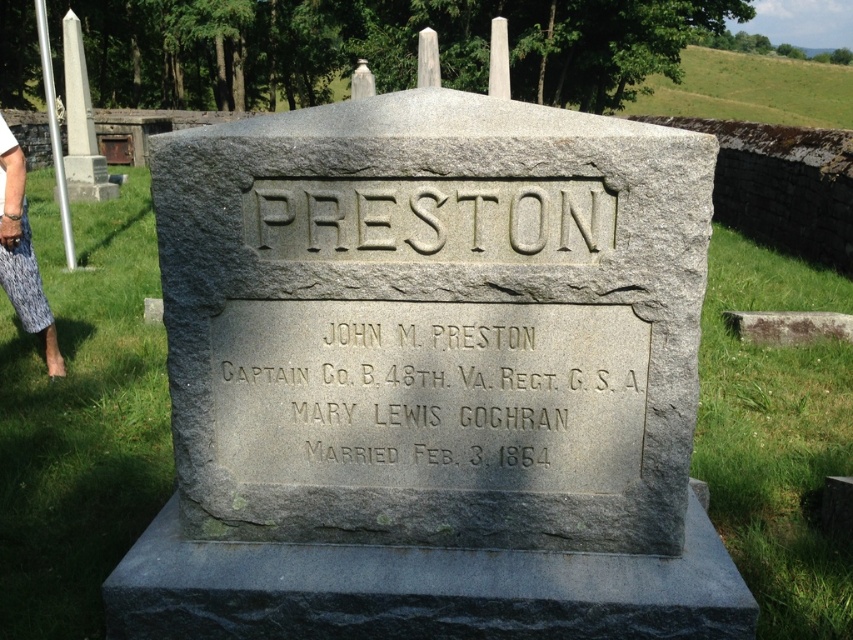
This screenshot has height=640, width=853. Describe the element at coordinates (431, 380) in the screenshot. I see `gray stone monument at center` at that location.

Is gray stone monument at center positioned before gold engraved text at center?

Yes.

Is point (596, 163) behind point (323, 326)?

No.

Image resolution: width=853 pixels, height=640 pixels. Find the location of `gray stone monument at center`. gray stone monument at center is located at coordinates (431, 380).

The width and height of the screenshot is (853, 640). I want to click on gold engraved text at center, so click(430, 394).

Does gold engraved text at center come in front of gray stone engraving at center?

No, gold engraved text at center is further to the viewer.

Is point (590, 483) closer to viewer compared to point (387, 216)?

That is False.

The width and height of the screenshot is (853, 640). In order to click on gold engraved text at center in this screenshot , I will do `click(430, 394)`.

Identify the location of gold engraved text at center. The height and width of the screenshot is (640, 853). (430, 394).